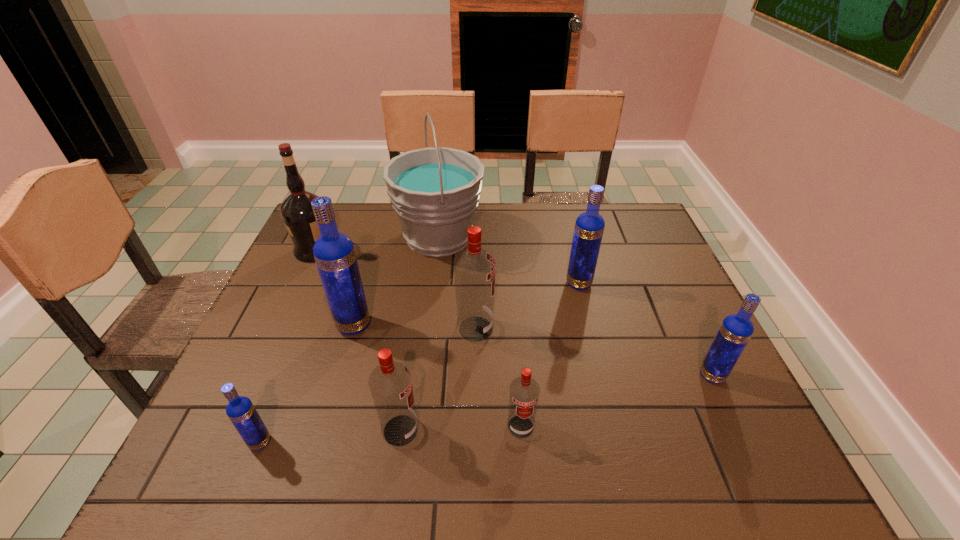
At what (x,y) coordinates should I click in order to perform the action: click on the fifth vodka from right to left. Please return your answer as a coordinate pair (x, y). Looking at the image, I should click on (390, 383).

The width and height of the screenshot is (960, 540). I want to click on the leftmost red vodka, so click(x=390, y=383).

Find the location of a particular element. The image size is (960, 540). the nearest blue vodka is located at coordinates (240, 410).

You are a GUI agent. You are given a task and a screenshot of the screen. Output one action in this format:
    pyautogui.click(x=<x>, y=<y>)
    Task: Click on the leftmost blue vodka
    The height and width of the screenshot is (540, 960).
    Given the screenshot: What is the action you would take?
    pyautogui.click(x=240, y=410)

The width and height of the screenshot is (960, 540). In order to click on the smallest red vodka in this screenshot , I will do `click(524, 391)`.

This screenshot has width=960, height=540. Identify the location of the rightmost red vodka. (524, 391).

In order to click on free region located on the right of the blue bucket in this screenshot , I will do `click(608, 237)`.

Locate an element on the screen. This screenshot has width=960, height=540. free region located on the left of the second vodka from left to right is located at coordinates (269, 325).

You are a GUI agent. You are given a task and a screenshot of the screen. Output one action in this format:
    pyautogui.click(x=<x>, y=<y>)
    Task: Click on the vacant space located on the surface of the liquor
    Image resolution: width=960 pixels, height=540 pixels.
    Given the screenshot: What is the action you would take?
    pyautogui.click(x=468, y=250)

This screenshot has width=960, height=540. I want to click on free space located 0.150m on the left of the second vodka from right to left, so click(x=512, y=284).